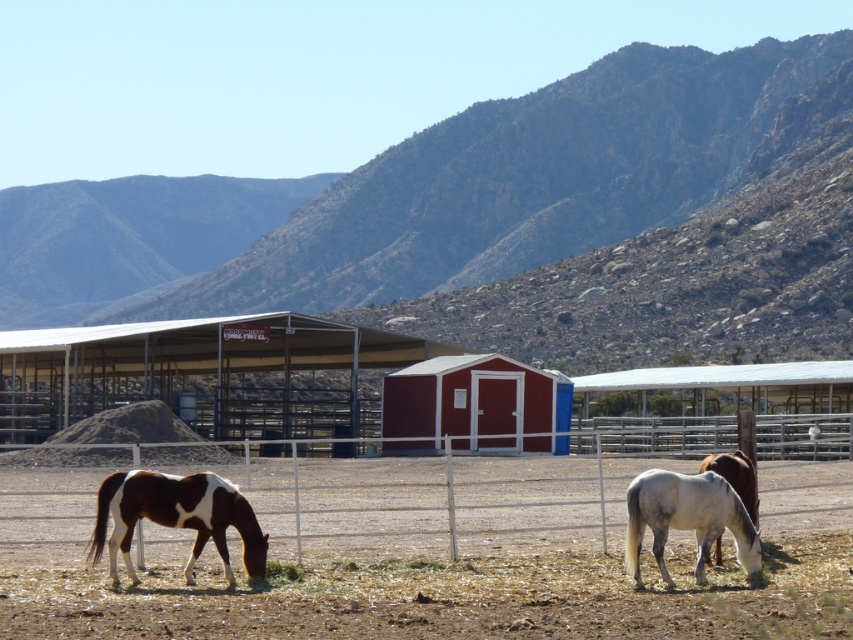
You are standing in the rural scene with the fenced area and horses. You want to take a photo of the rugged rock mountain at upper center. Where should you position yourself to capture it in the frame?

To capture the rugged rock mountain at upper center in your photo, position yourself so that the mountain is centered at the coordinates approximately 0.311 on the horizontal axis and 0.646 on the vertical axis within the frame.

You are a hiker who wants to take a photo of the rugged rock mountain at upper center. Where should you position yourself to capture it in the frame?

The rugged rock mountain at upper center is located at point [550,198] in the image, so you should position yourself facing that coordinate to capture it in the frame.

You are a hiker who wants to take a photo of the rugged rock mountain at upper center and the smooth red shed at center from the same spot. Which object will appear larger in the photo?

The rugged rock mountain at upper center will appear larger in the photo because it is positioned above the smooth red shed at center, making it closer to the camera and thus larger in the frame.